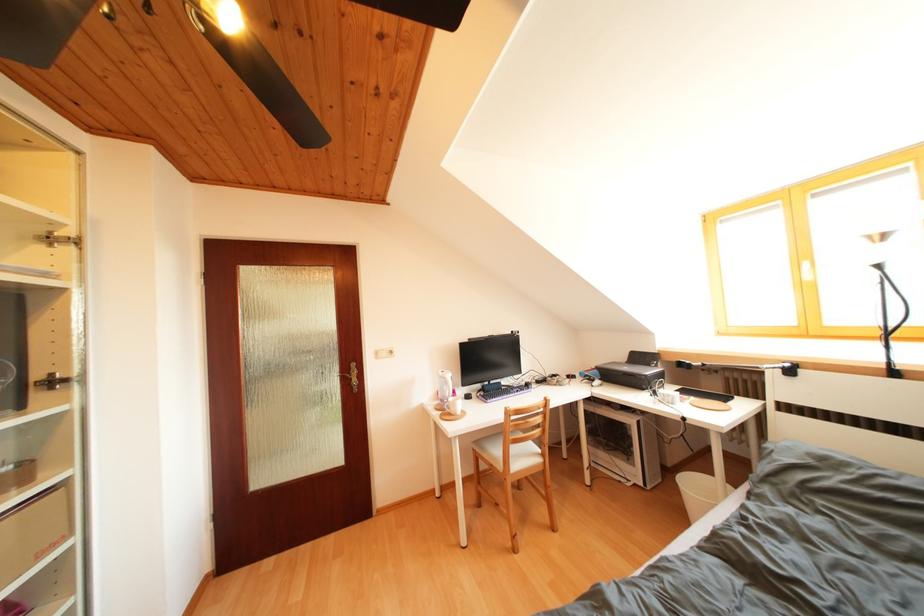
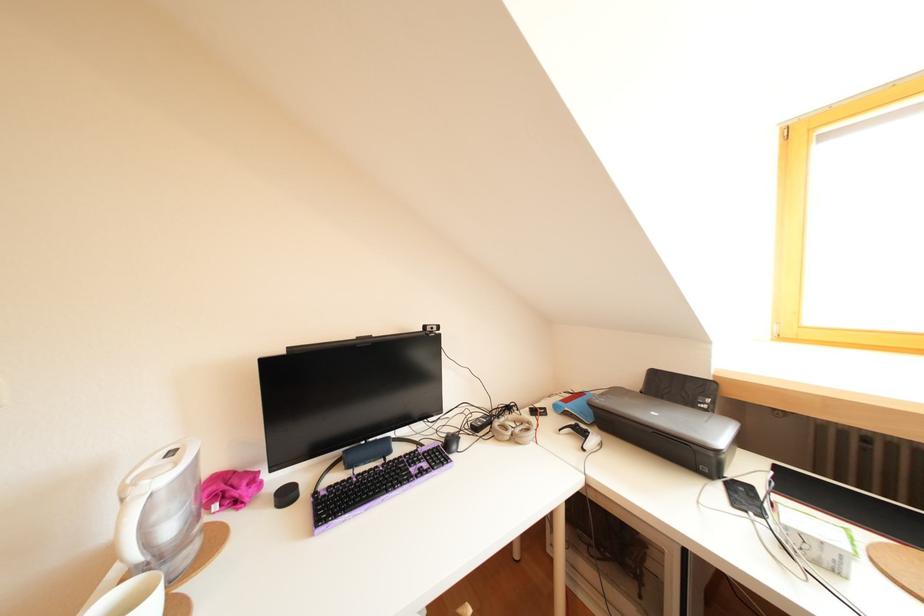
The point at (x=562, y=381) is marked in the first image. Where is the corresponding point in the second image?

(516, 413)